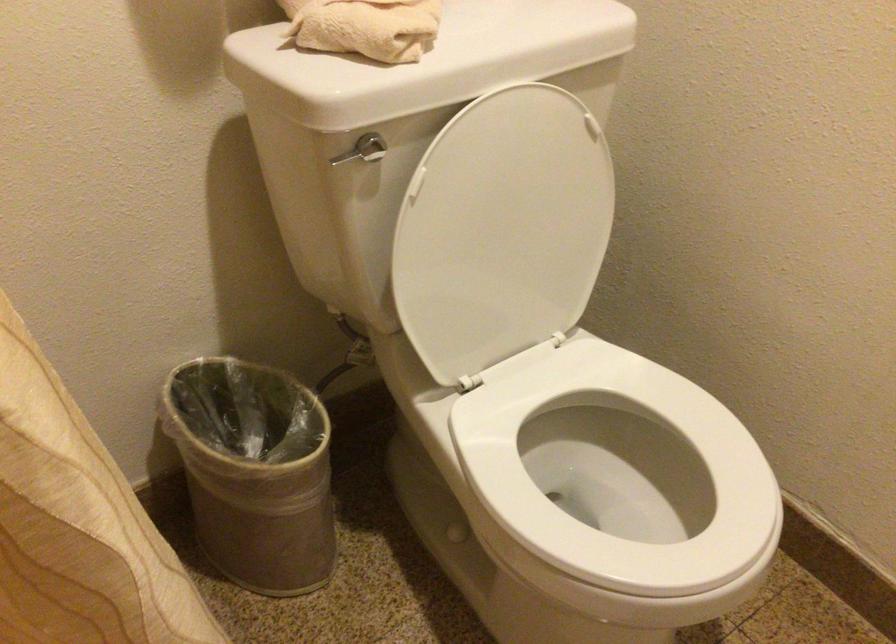
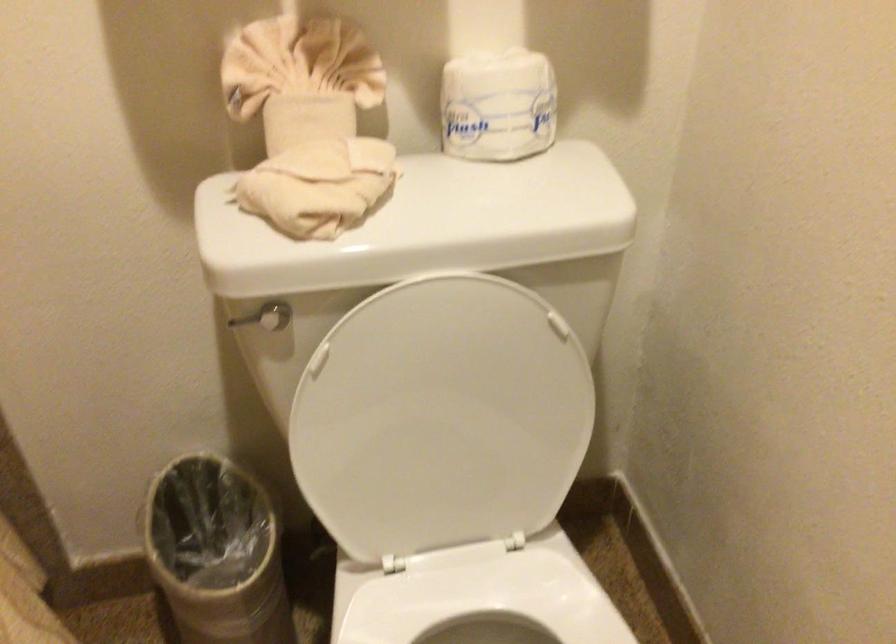
In a continuous first-person perspective shot, in which direction is the camera moving?

The movement direction of the cameraman is right, forward.